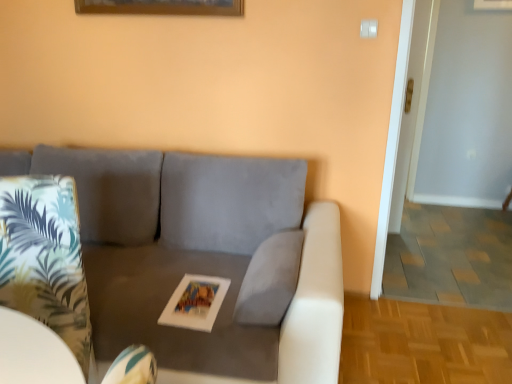
Measure the distance between suede gray couch at center and camera.

The depth of suede gray couch at center is 1.43 meters.

The height and width of the screenshot is (384, 512). What do you see at coordinates (205, 260) in the screenshot? I see `suede gray couch at center` at bounding box center [205, 260].

In order to face suede gray couch at center, should I rotate leftwards or rightwards?

Rotate left and turn 23.566 degrees.

In order to click on suede gray couch at center in this screenshot , I will do `click(205, 260)`.

Where is `suede gray couch at center`? This screenshot has width=512, height=384. suede gray couch at center is located at coordinates (205, 260).